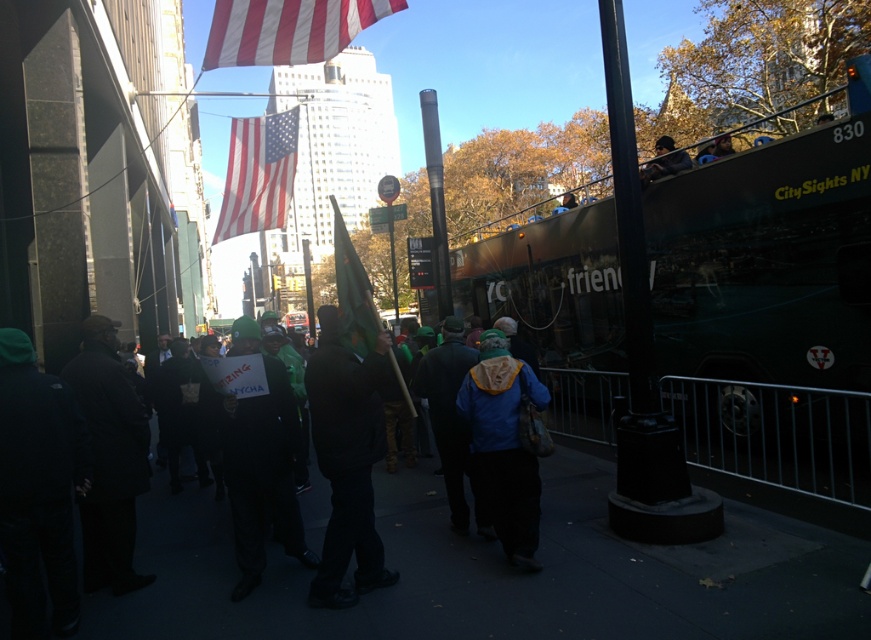
Question: Is the position of black matte jacket at center less distant than that of american flag at center?

Choices:
 (A) no
 (B) yes

Answer: (B)

Question: Can you confirm if black matte jacket at center is smaller than blue fleece jacket at center?

Choices:
 (A) yes
 (B) no

Answer: (B)

Question: Which is farther from the blue fleece jacket at center?

Choices:
 (A) dark green fabric at center
 (B) american flag at center
 (C) dark gray coat at left
 (D) green fabric flag at center

Answer: (B)

Question: Which object is farther from the camera taking this photo?

Choices:
 (A) dark brown leather jacket at upper center
 (B) dark green fabric at center

Answer: (A)

Question: Can you confirm if dark green fabric at center is wider than green fabric flag at center?

Choices:
 (A) yes
 (B) no

Answer: (B)

Question: Estimate the real-world distances between objects in this image. Which object is closer to the dark green fabric at center?

Choices:
 (A) dark brown leather jacket at upper center
 (B) american flag at center
 (C) black matte jacket at center
 (D) dark gray coat at left

Answer: (C)